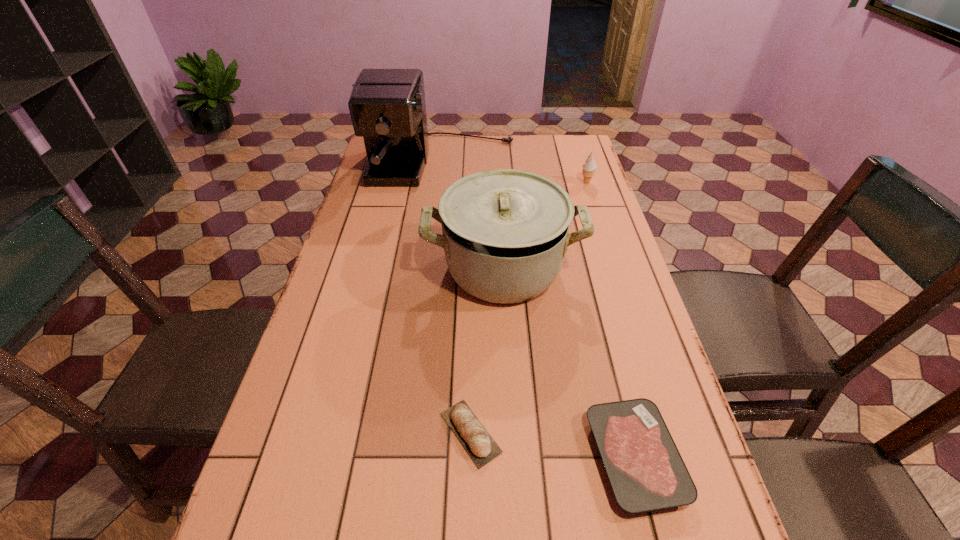
This screenshot has height=540, width=960. Identify the location of free region that satisfies the following two spatial constraints: 1. on the front-facing side of the shortest object; 2. on the right side of the coffee maker. (406, 457).

The width and height of the screenshot is (960, 540). Find the location of `free location that satisfies the following two spatial constraints: 1. on the front-facing side of the tallest object; 2. on the right side of the saucepan`. free location that satisfies the following two spatial constraints: 1. on the front-facing side of the tallest object; 2. on the right side of the saucepan is located at coordinates (429, 268).

Locate an element on the screen. free space that satisfies the following two spatial constraints: 1. on the front-facing side of the coffee maker; 2. on the left side of the third nearest object is located at coordinates (429, 268).

You are a GUI agent. You are given a task and a screenshot of the screen. Output one action in this format:
    pyautogui.click(x=<x>, y=<y>)
    Task: Click on the free space that satisfies the following two spatial constraints: 1. on the front-facing side of the pita bread; 2. on the left side of the tallest object
    Image resolution: width=960 pixels, height=540 pixels.
    Given the screenshot: What is the action you would take?
    pyautogui.click(x=409, y=433)

Where is `vacant position in the image that satisfies the following two spatial constraints: 1. on the front-facing side of the third farthest object; 2. on the left side of the coffee maker`? vacant position in the image that satisfies the following two spatial constraints: 1. on the front-facing side of the third farthest object; 2. on the left side of the coffee maker is located at coordinates click(429, 268).